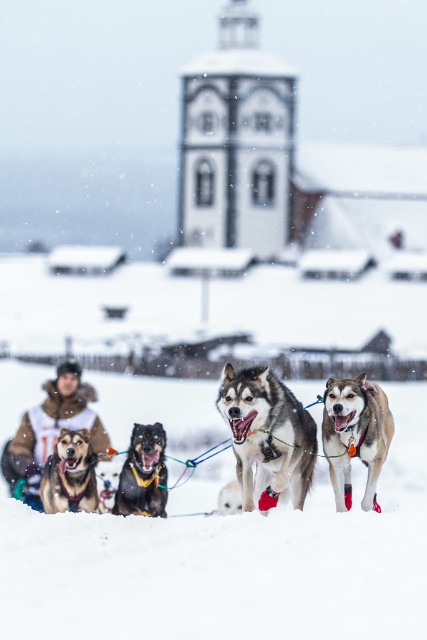
In the dog sled race scene, you see the white fluffy snow at center and the light brown fur at center. Which object takes up more space in the image?

The white fluffy snow at center has a larger size compared to light brown fur at center, so it takes up more space in the image.

You are a participant in the dog sled race and need to navigate to the snow at the specified coordinate. Can you reach the white fluffy snow at center located at point [231,563] without encountering any obstacles?

The white fluffy snow at center is located at point [231,563], so yes, you can reach it as there are no obstacles mentioned in the scene description.

Based on the photo, you are a photographer trying to capture the black fur dog at center and the white fluffy snow at center in the same frame. Based on their positions, which object is closer to the camera?

The white fluffy snow at center is closer to the camera because it is positioned in front of the black fur dog at center.